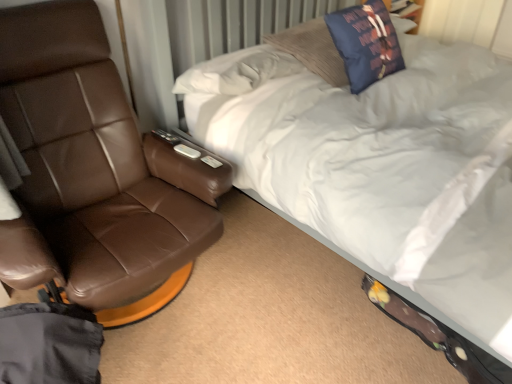
Question: From the image's perspective, is white soft bed at upper right located above navy blue fabric pillow at upper center?

Choices:
 (A) yes
 (B) no

Answer: (B)

Question: Does white soft bed at upper right have a lesser width compared to navy blue fabric pillow at upper center?

Choices:
 (A) yes
 (B) no

Answer: (B)

Question: Considering the relative sizes of white soft bed at upper right and navy blue fabric pillow at upper center in the image provided, is white soft bed at upper right smaller than navy blue fabric pillow at upper center?

Choices:
 (A) no
 (B) yes

Answer: (A)

Question: Could you tell me if white soft bed at upper right is turned towards navy blue fabric pillow at upper center?

Choices:
 (A) yes
 (B) no

Answer: (A)

Question: From a real-world perspective, is white soft bed at upper right on navy blue fabric pillow at upper center?

Choices:
 (A) yes
 (B) no

Answer: (B)

Question: Is white soft bed at upper right in front of navy blue fabric pillow at upper center?

Choices:
 (A) yes
 (B) no

Answer: (A)

Question: Considering the relative sizes of white soft bed at upper right and brown leather chair at left in the image provided, is white soft bed at upper right thinner than brown leather chair at left?

Choices:
 (A) no
 (B) yes

Answer: (A)

Question: Is white soft bed at upper right oriented away from brown leather chair at left?

Choices:
 (A) yes
 (B) no

Answer: (B)

Question: From a real-world perspective, is white soft bed at upper right physically below brown leather chair at left?

Choices:
 (A) no
 (B) yes

Answer: (A)

Question: Is white soft bed at upper right not near brown leather chair at left?

Choices:
 (A) yes
 (B) no

Answer: (B)

Question: Considering the relative positions of white soft bed at upper right and brown leather chair at left in the image provided, is white soft bed at upper right to the left of brown leather chair at left from the viewer's perspective?

Choices:
 (A) no
 (B) yes

Answer: (A)

Question: Does white soft bed at upper right have a larger size compared to brown leather chair at left?

Choices:
 (A) no
 (B) yes

Answer: (B)

Question: Does brown leather chair at left lie behind white soft bed at upper right?

Choices:
 (A) no
 (B) yes

Answer: (B)